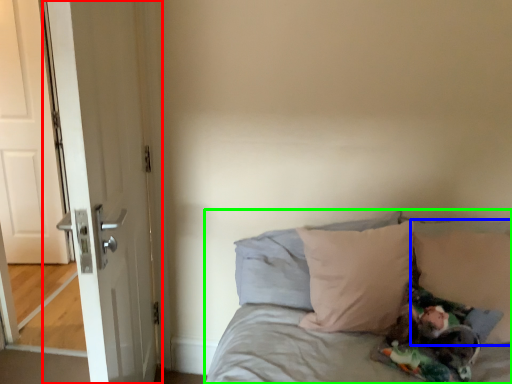
Question: Considering the real-world distances, which object is closest to door (highlighted by a red box)? pillow (highlighted by a blue box) or bed (highlighted by a green box).

Choices:
 (A) pillow
 (B) bed

Answer: (B)